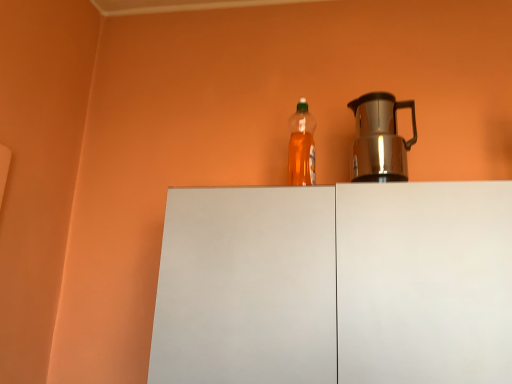
Question: Is translucent plastic bottle at center further to the viewer compared to white matte cabinet at center?

Choices:
 (A) no
 (B) yes

Answer: (B)

Question: Considering the relative sizes of translucent plastic bottle at center and white matte cabinet at center in the image provided, is translucent plastic bottle at center bigger than white matte cabinet at center?

Choices:
 (A) yes
 (B) no

Answer: (B)

Question: Is translucent plastic bottle at center turned away from white matte cabinet at center?

Choices:
 (A) no
 (B) yes

Answer: (A)

Question: Is translucent plastic bottle at center positioned far away from white matte cabinet at center?

Choices:
 (A) no
 (B) yes

Answer: (A)

Question: From the image's perspective, is translucent plastic bottle at center located beneath white matte cabinet at center?

Choices:
 (A) yes
 (B) no

Answer: (B)

Question: From the image's perspective, does translucent plastic bottle at center appear higher than white matte cabinet at center?

Choices:
 (A) yes
 (B) no

Answer: (A)

Question: Does shiny metallic kettle at right have a lesser width compared to white matte cabinet at center?

Choices:
 (A) no
 (B) yes

Answer: (B)

Question: Can you confirm if shiny metallic kettle at right is positioned to the left of white matte cabinet at center?

Choices:
 (A) yes
 (B) no

Answer: (B)

Question: From the image's perspective, does shiny metallic kettle at right appear lower than white matte cabinet at center?

Choices:
 (A) no
 (B) yes

Answer: (A)

Question: Can you confirm if shiny metallic kettle at right is taller than white matte cabinet at center?

Choices:
 (A) no
 (B) yes

Answer: (A)

Question: Considering the relative sizes of shiny metallic kettle at right and white matte cabinet at center in the image provided, is shiny metallic kettle at right wider than white matte cabinet at center?

Choices:
 (A) no
 (B) yes

Answer: (A)

Question: Can you confirm if shiny metallic kettle at right is bigger than white matte cabinet at center?

Choices:
 (A) yes
 (B) no

Answer: (B)

Question: Does shiny metallic kettle at right have a greater width compared to translucent plastic bottle at center?

Choices:
 (A) yes
 (B) no

Answer: (A)